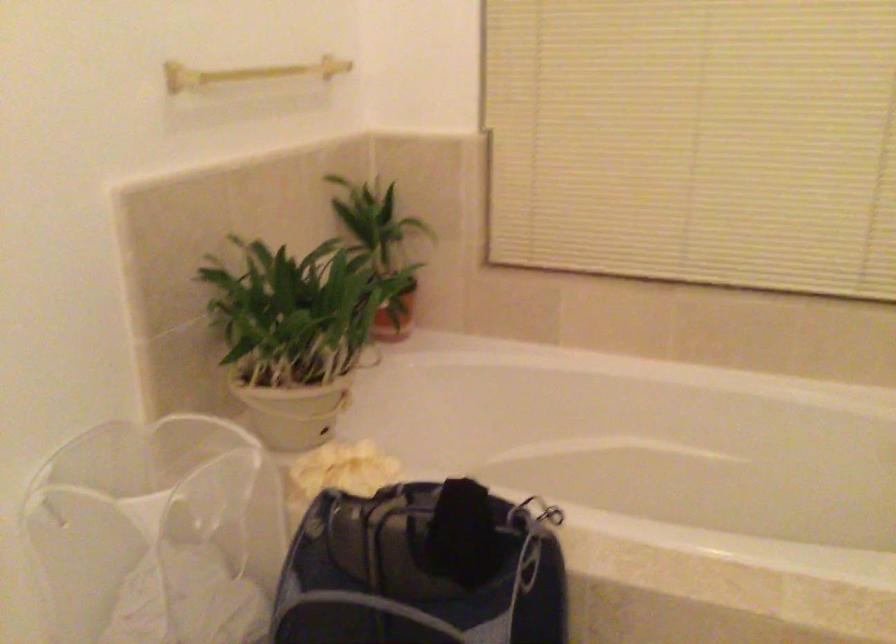
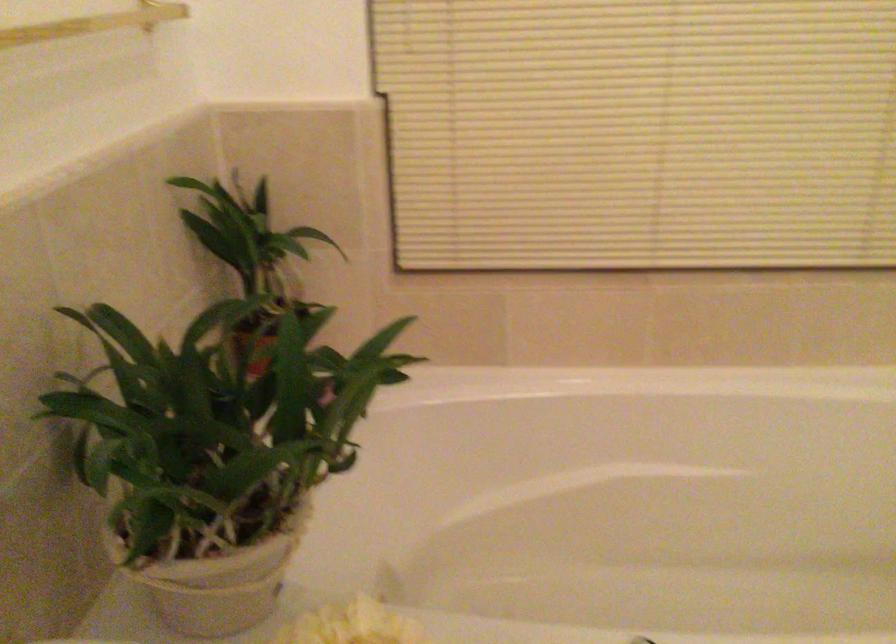
Question: I am providing you with two images of the same scene from different viewpoints. Which of the following objects are not visible in image2?

Choices:
 (A) yellow bath sponge
 (B) fabric plant pot
 (C) yellow toy dart
 (D) terracotta plant pot

Answer: (D)